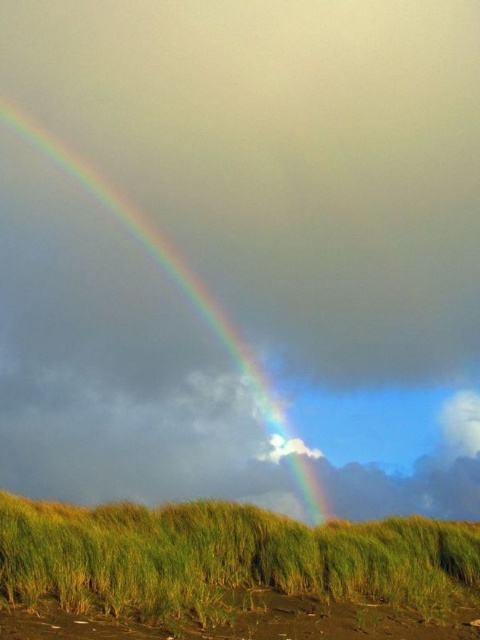
You are standing in the scene and want to walk to the lower center area. Which area would you step into first, the green grassy at lower center or the brown sandy beach at lower center?

The green grassy at lower center might be wider than brown sandy beach at lower center, so you would step into the green grassy at lower center first.

You are standing on the brown sandy beach at lower center and looking up at the rainbow at upper left. Which object is closer to you?

The brown sandy beach at lower center is closer to you since it is in front of the rainbow at upper left.